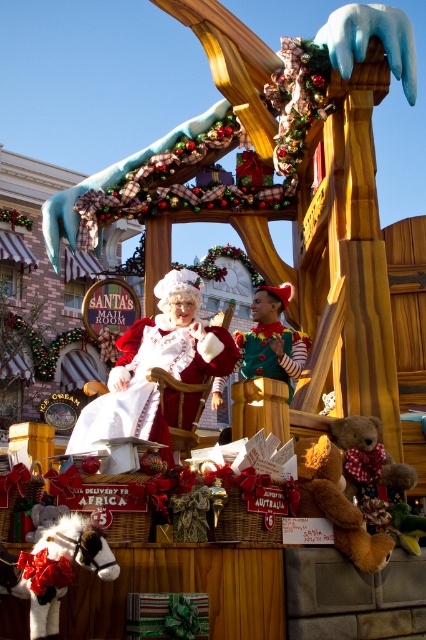
You are standing in front of the Christmas float and want to take a photo of the two points marked on the float. Which point, point (106, 403) or point (365, 417), will appear larger in your photo?

Point (106, 403) will appear larger in the photo because it is closer to the camera than point (365, 417).

You are a parade attendee standing in front of the Christmas float. You want to take a photo of both the fluffy brown teddy bear at center and the green felt elf at center in the same frame. Can you fit both of them in your camera viewfinder if your camera has a maximum field of view of 20 meters width?

The fluffy brown teddy bear at center and the green felt elf at center are 19.34 meters apart. Since your camera can capture up to 20 meters width, you can fit both in the same frame as their distance is within the camera field of view.

You are a parade attendee standing in front of the Christmas float. You want to take a photo of both the fluffy brown teddy bear at center and the green felt elf at center. Which one should you focus on first to ensure both are in the frame?

You should focus on the green felt elf at center first because it is larger than the fluffy brown teddy bear at center, ensuring it fits within the frame while the smaller teddy bear can be positioned alongside it.